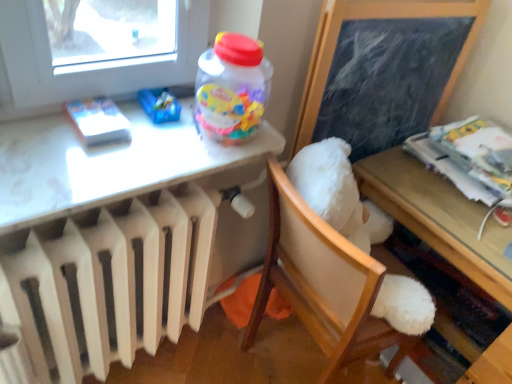
Question: From the image's perspective, is wooden table at lower right, the 1th table viewed from the right, on top of white matte book at upper left, marked as the first magazine in a front-to-back arrangement?

Choices:
 (A) yes
 (B) no

Answer: (B)

Question: Does wooden table at lower right, the 1th table viewed from the right, have a lesser width compared to white matte book at upper left, the 2th magazine from the back?

Choices:
 (A) no
 (B) yes

Answer: (A)

Question: Considering the relative sizes of wooden table at lower right, the 1th table viewed from the right, and white matte book at upper left, marked as the first magazine in a front-to-back arrangement, in the image provided, is wooden table at lower right, the 1th table viewed from the right, taller than white matte book at upper left, marked as the first magazine in a front-to-back arrangement,?

Choices:
 (A) no
 (B) yes

Answer: (B)

Question: Is white matte book at upper left, placed as the 1th magazine when sorted from left to right, located within wooden table at lower right, which appears as the 2th table when viewed from the left?

Choices:
 (A) no
 (B) yes

Answer: (A)

Question: Does wooden table at lower right, the 1th table viewed from the right, have a greater width compared to white matte book at upper left, placed as the 2th magazine when sorted from right to left?

Choices:
 (A) no
 (B) yes

Answer: (B)

Question: Is white plastic radiator at lower left inside the boundaries of white glossy table at upper left, which ranks as the first table in left-to-right order, or outside?

Choices:
 (A) outside
 (B) inside

Answer: (A)

Question: Is point (90, 205) positioned closer to the camera than point (141, 140)?

Choices:
 (A) farther
 (B) closer

Answer: (B)

Question: Considering the positions of white plastic radiator at lower left and white glossy table at upper left, which appears as the 2th table when viewed from the right, in the image, is white plastic radiator at lower left bigger or smaller than white glossy table at upper left, which appears as the 2th table when viewed from the right,?

Choices:
 (A) small
 (B) big

Answer: (B)

Question: Visually, is white plastic radiator at lower left positioned to the left or to the right of white glossy table at upper left, which appears as the 2th table when viewed from the right?

Choices:
 (A) left
 (B) right

Answer: (A)

Question: Visually, is white glossy table at upper left, which appears as the 2th table when viewed from the right, positioned to the left or to the right of white matte book at upper left, placed as the 1th magazine when sorted from left to right?

Choices:
 (A) left
 (B) right

Answer: (B)

Question: Relative to white matte book at upper left, the 2th magazine from the back, is white glossy table at upper left, which ranks as the first table in left-to-right order, in front or behind?

Choices:
 (A) front
 (B) behind

Answer: (A)

Question: Is white glossy table at upper left, which appears as the 2th table when viewed from the right, inside or outside of white matte book at upper left, marked as the first magazine in a front-to-back arrangement?

Choices:
 (A) inside
 (B) outside

Answer: (B)

Question: Is white glossy table at upper left, which ranks as the first table in left-to-right order, taller or shorter than white matte book at upper left, placed as the 1th magazine when sorted from left to right?

Choices:
 (A) short
 (B) tall

Answer: (B)

Question: Looking at their shapes, would you say wooden table at lower right, the 1th table viewed from the right, is wider or thinner than printed paper stack at right, which ranks as the first magazine in right-to-left order?

Choices:
 (A) thin
 (B) wide

Answer: (B)

Question: From the image's perspective, is wooden table at lower right, which appears as the 2th table when viewed from the left, located above or below printed paper stack at right, which ranks as the first magazine in right-to-left order?

Choices:
 (A) below
 (B) above

Answer: (A)